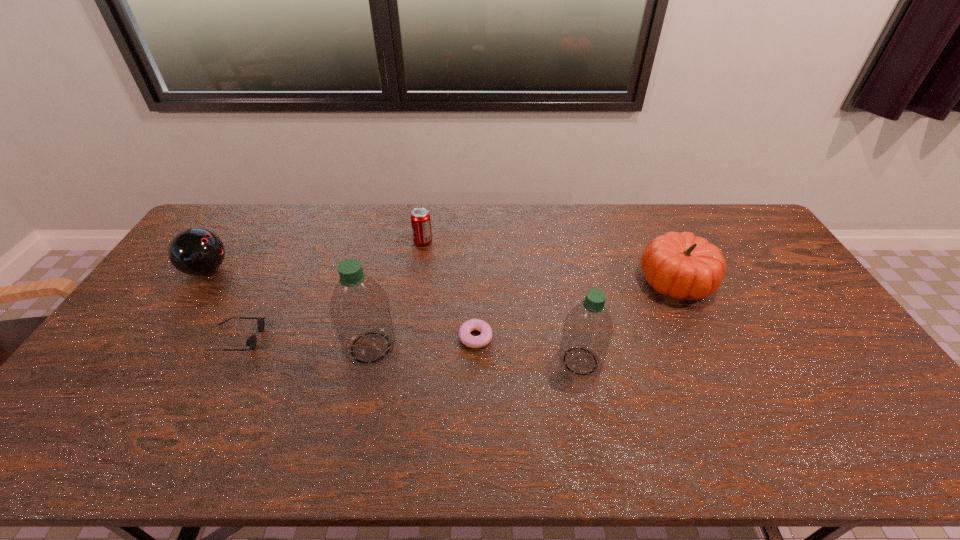
Where is `the left water bottle`? the left water bottle is located at coordinates (360, 310).

I want to click on the tallest object, so click(360, 310).

The image size is (960, 540). Find the location of `the shorter water bottle`. the shorter water bottle is located at coordinates (588, 329).

At what (x,y) coordinates should I click in order to perform the action: click on the right water bottle. Please return your answer as a coordinate pair (x, y). Image resolution: width=960 pixels, height=540 pixels. Looking at the image, I should click on (588, 329).

Find the location of a particular element. This screenshot has height=540, width=960. the third shortest object is located at coordinates (420, 217).

Locate an element on the screen. The width and height of the screenshot is (960, 540). the farthest object is located at coordinates (420, 217).

What are the coordinates of `the sixth tallest object` in the screenshot? It's located at (252, 340).

Where is `sunglasses`? This screenshot has height=540, width=960. sunglasses is located at coordinates (252, 340).

The image size is (960, 540). I want to click on bowling ball, so click(194, 251).

This screenshot has height=540, width=960. I want to click on the rightmost object, so click(681, 265).